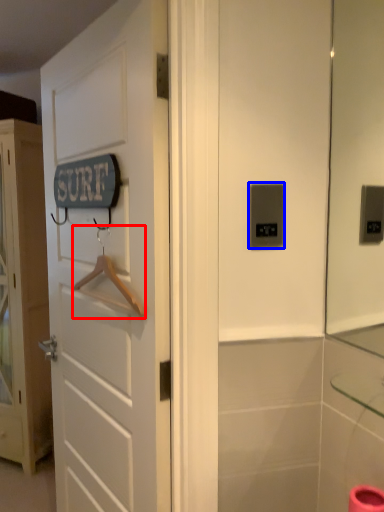
Question: Which point is closer to the camera, hanger (highlighted by a red box) or light switch (highlighted by a blue box)?

Choices:
 (A) hanger
 (B) light switch

Answer: (B)